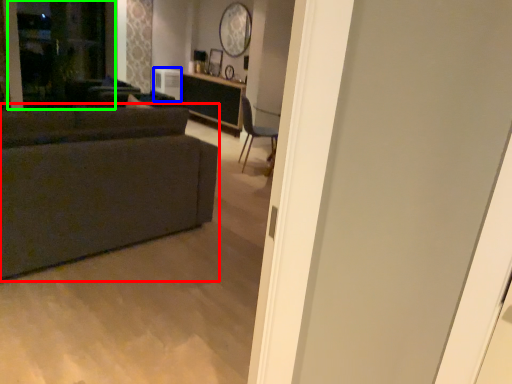
Question: Estimate the real-world distances between objects in this image. Which object is farther from studio couch (highlighted by a red box), appliance (highlighted by a blue box) or screen door (highlighted by a green box)?

Choices:
 (A) appliance
 (B) screen door

Answer: (A)